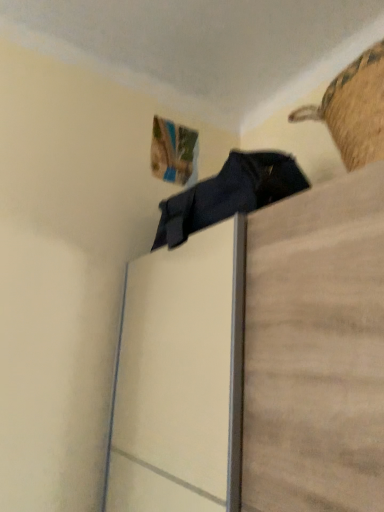
Describe the element at coordinates (257, 362) in the screenshot. I see `matte black clothing at upper center` at that location.

Find the location of a particular element. The width and height of the screenshot is (384, 512). matte black clothing at upper center is located at coordinates (257, 362).

Where is `woven straw basket at upper right`? This screenshot has height=512, width=384. woven straw basket at upper right is located at coordinates (354, 109).

What is the approximate width of woven straw basket at upper right?

18.20 inches.

Measure the distance between woven straw basket at upper right and camera.

woven straw basket at upper right is 35.28 inches from camera.

Describe the element at coordinates (354, 109) in the screenshot. This screenshot has height=512, width=384. I see `woven straw basket at upper right` at that location.

Find the location of a particular element. This screenshot has width=384, height=512. matte black clothing at upper center is located at coordinates (257, 362).

Considering the positions of objects matte black clothing at upper center and woven straw basket at upper right in the image provided, who is more to the right, matte black clothing at upper center or woven straw basket at upper right?

Positioned to the right is woven straw basket at upper right.

Is matte black clothing at upper center positioned before woven straw basket at upper right?

That is True.

Considering the positions of points (314, 215) and (375, 128), is point (314, 215) farther from camera compared to point (375, 128)?

Yes, it is behind point (375, 128).

From the image's perspective, who appears lower, matte black clothing at upper center or woven straw basket at upper right?

matte black clothing at upper center appears lower in the image.

From a real-world perspective, which object stands above the other?

woven straw basket at upper right.

Considering the sizes of objects matte black clothing at upper center and woven straw basket at upper right in the image provided, who is wider, matte black clothing at upper center or woven straw basket at upper right?

Wider between the two is matte black clothing at upper center.

Considering the sizes of objects matte black clothing at upper center and woven straw basket at upper right in the image provided, who is shorter, matte black clothing at upper center or woven straw basket at upper right?

With less height is woven straw basket at upper right.

Considering the relative sizes of matte black clothing at upper center and woven straw basket at upper right in the image provided, is matte black clothing at upper center bigger than woven straw basket at upper right?

Yes.

Is woven straw basket at upper right completely or partially inside matte black clothing at upper center?

No, woven straw basket at upper right is not inside matte black clothing at upper center.

Is there a large distance between matte black clothing at upper center and woven straw basket at upper right?

Yes, matte black clothing at upper center and woven straw basket at upper right are located far from each other.

Is woven straw basket at upper right at the back of matte black clothing at upper center?

No.

How different are the orientations of matte black clothing at upper center and woven straw basket at upper right in degrees?

They differ by 4.03 degrees in their facing directions.

Locate an element on the screen. This screenshot has height=512, width=384. furniture in front of the woven straw basket at upper right is located at coordinates (257, 362).

Which object is positioned more to the right, woven straw basket at upper right or matte black clothing at upper center?

From the viewer's perspective, woven straw basket at upper right appears more on the right side.

Which object is more forward, woven straw basket at upper right or matte black clothing at upper center?

matte black clothing at upper center is closer to the camera.

Considering the positions of points (366, 156) and (287, 313), is point (366, 156) closer to camera compared to point (287, 313)?

Yes, it is.

From the image's perspective, which one is positioned higher, woven straw basket at upper right or matte black clothing at upper center?

woven straw basket at upper right, from the image's perspective.

From a real-world perspective, which is physically below, woven straw basket at upper right or matte black clothing at upper center?

matte black clothing at upper center, from a real-world perspective.

Looking at their sizes, would you say woven straw basket at upper right is wider or thinner than matte black clothing at upper center?

Considering their sizes, woven straw basket at upper right looks slimmer than matte black clothing at upper center.

In terms of height, does woven straw basket at upper right look taller or shorter compared to matte black clothing at upper center?

Clearly, woven straw basket at upper right is shorter compared to matte black clothing at upper center.

Is woven straw basket at upper right smaller than matte black clothing at upper center?

Indeed, woven straw basket at upper right has a smaller size compared to matte black clothing at upper center.

From the picture: Is woven straw basket at upper right positioned beyond the bounds of matte black clothing at upper center?

Yes, woven straw basket at upper right is located beyond the bounds of matte black clothing at upper center.

Is woven straw basket at upper right not near matte black clothing at upper center?

Indeed, woven straw basket at upper right is not near matte black clothing at upper center.

Is woven straw basket at upper right oriented away from matte black clothing at upper center?

woven straw basket at upper right does not have its back to matte black clothing at upper center.

How many degrees apart are the facing directions of woven straw basket at upper right and matte black clothing at upper center?

There is a 4.03-degree angle between the facing directions of woven straw basket at upper right and matte black clothing at upper center.

This screenshot has height=512, width=384. Identify the location of basket behind the matte black clothing at upper center. (354, 109).

The width and height of the screenshot is (384, 512). Identify the location of furniture on the left of woven straw basket at upper right. (257, 362).

At what (x,y) coordinates should I click in order to perform the action: click on furniture that is below the woven straw basket at upper right (from the image's perspective). Please return your answer as a coordinate pair (x, y). Looking at the image, I should click on (257, 362).